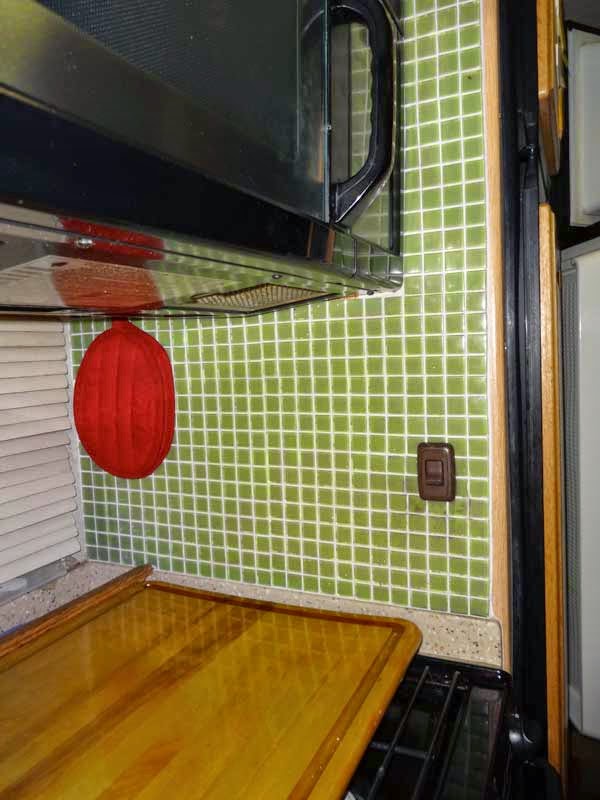
In order to click on cutting board in this screenshot , I will do `click(203, 706)`.